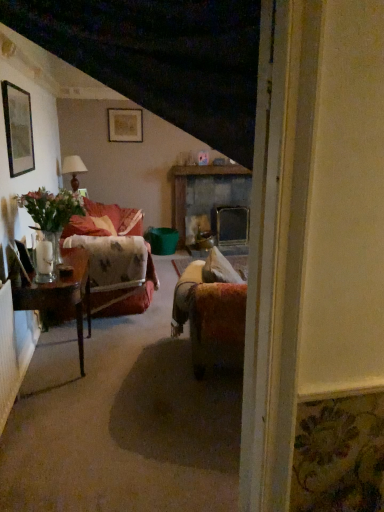
Question: Considering the relative sizes of velvet floral couch at left and matte gold picture frame at upper center, which is the first picture frame from right to left, in the image provided, is velvet floral couch at left wider than matte gold picture frame at upper center, which is the first picture frame from right to left,?

Choices:
 (A) yes
 (B) no

Answer: (A)

Question: Is velvet floral couch at left to the left of matte gold picture frame at upper center, which ranks as the first picture frame in back-to-front order, from the viewer's perspective?

Choices:
 (A) yes
 (B) no

Answer: (A)

Question: Is velvet floral couch at left turned away from matte gold picture frame at upper center, which is the 2th picture frame from front to back?

Choices:
 (A) no
 (B) yes

Answer: (A)

Question: Does velvet floral couch at left come behind matte gold picture frame at upper center, placed as the 1th picture frame when sorted from top to bottom?

Choices:
 (A) yes
 (B) no

Answer: (B)

Question: From a real-world perspective, is velvet floral couch at left beneath matte gold picture frame at upper center, which is the first picture frame from right to left?

Choices:
 (A) no
 (B) yes

Answer: (B)

Question: Is the surface of velvet floral couch at left in direct contact with matte gold picture frame at upper center, which ranks as the first picture frame in back-to-front order?

Choices:
 (A) yes
 (B) no

Answer: (B)

Question: Is velvet floral couch at left touching green matte picture frame at upper left, which appears as the 2th picture frame when viewed from the right?

Choices:
 (A) no
 (B) yes

Answer: (A)

Question: Would you say velvet floral couch at left is a long distance from green matte picture frame at upper left, which ranks as the second picture frame in back-to-front order?

Choices:
 (A) yes
 (B) no

Answer: (A)

Question: Is velvet floral couch at left at the left side of green matte picture frame at upper left, which appears as the 2th picture frame when viewed from the right?

Choices:
 (A) no
 (B) yes

Answer: (A)

Question: Is velvet floral couch at left oriented towards green matte picture frame at upper left, which appears as the 2th picture frame when viewed from the right?

Choices:
 (A) yes
 (B) no

Answer: (B)

Question: From the image's perspective, does velvet floral couch at left appear lower than green matte picture frame at upper left, acting as the 1th picture frame starting from the front?

Choices:
 (A) yes
 (B) no

Answer: (A)

Question: Is velvet floral couch at left oriented away from green matte picture frame at upper left, which ranks as the second picture frame in back-to-front order?

Choices:
 (A) yes
 (B) no

Answer: (B)

Question: Is matte brown lamp at upper left shorter than green matte picture frame at upper left, which appears as the 2th picture frame when viewed from the right?

Choices:
 (A) no
 (B) yes

Answer: (B)